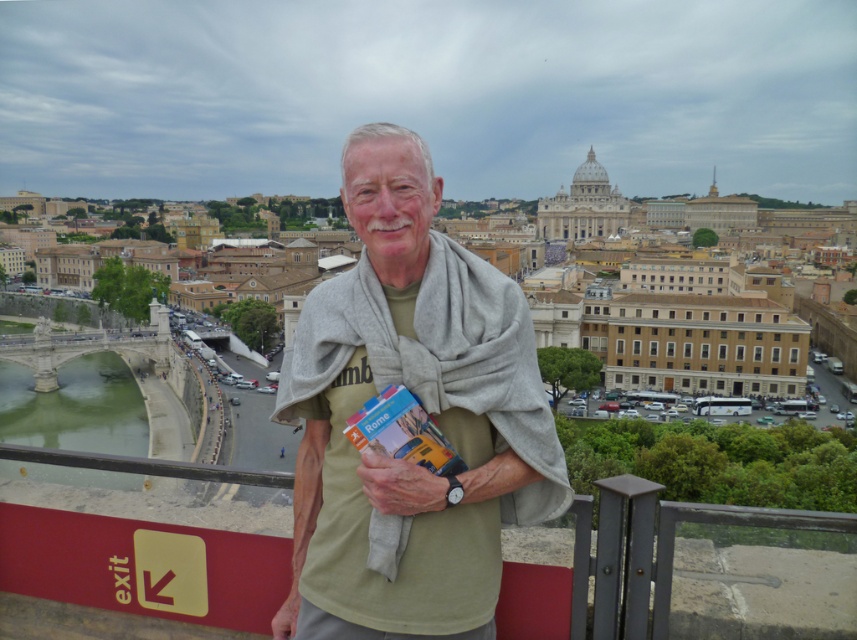
Who is positioned more to the right, light green cotton shirt at center or light brown leather hand at center?

light green cotton shirt at center is more to the right.

Between light green cotton shirt at center and light brown leather hand at center, which one appears on the left side from the viewer's perspective?

From the viewer's perspective, light brown leather hand at center appears more on the left side.

Is point (441, 321) positioned behind point (382, 461)?

Yes.

You are a GUI agent. You are given a task and a screenshot of the screen. Output one action in this format:
    pyautogui.click(x=<x>, y=<y>)
    Task: Click on the light green cotton shirt at center
    
    Given the screenshot: What is the action you would take?
    pyautogui.click(x=423, y=406)